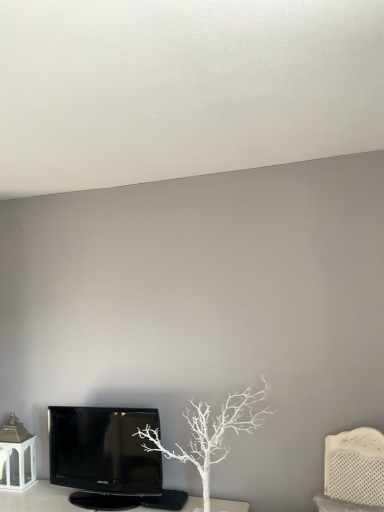
Question: Is white matte tree at center at the left side of white textured headboard at right?

Choices:
 (A) yes
 (B) no

Answer: (A)

Question: From the image's perspective, does white matte tree at center appear lower than white textured headboard at right?

Choices:
 (A) yes
 (B) no

Answer: (B)

Question: Does white matte tree at center have a lesser width compared to white textured headboard at right?

Choices:
 (A) yes
 (B) no

Answer: (B)

Question: Considering the relative sizes of white matte tree at center and white textured headboard at right in the image provided, is white matte tree at center wider than white textured headboard at right?

Choices:
 (A) yes
 (B) no

Answer: (A)

Question: Is white textured headboard at right completely or partially inside white matte tree at center?

Choices:
 (A) no
 (B) yes

Answer: (A)

Question: From the image's perspective, is white matte tree at center located above or below black glossy television at lower left?

Choices:
 (A) above
 (B) below

Answer: (A)

Question: From a real-world perspective, relative to black glossy television at lower left, is white matte tree at center vertically above or below?

Choices:
 (A) above
 (B) below

Answer: (A)

Question: Considering the positions of white matte tree at center and black glossy television at lower left in the image, is white matte tree at center bigger or smaller than black glossy television at lower left?

Choices:
 (A) small
 (B) big

Answer: (B)

Question: From their relative heights in the image, would you say white matte tree at center is taller or shorter than black glossy television at lower left?

Choices:
 (A) short
 (B) tall

Answer: (B)

Question: Is point (87, 454) positioned closer to the camera than point (193, 457)?

Choices:
 (A) farther
 (B) closer

Answer: (A)

Question: From a real-world perspective, is black glossy television at lower left above or below white matte tree at center?

Choices:
 (A) below
 (B) above

Answer: (A)

Question: Looking at their shapes, would you say black glossy television at lower left is wider or thinner than white matte tree at center?

Choices:
 (A) wide
 (B) thin

Answer: (B)

Question: From the image's perspective, is black glossy television at lower left located above or below white matte tree at center?

Choices:
 (A) below
 (B) above

Answer: (A)

Question: Is point (354, 449) positioned closer to the camera than point (140, 484)?

Choices:
 (A) farther
 (B) closer

Answer: (B)

Question: Is white textured headboard at right inside or outside of black glossy television at lower left?

Choices:
 (A) inside
 (B) outside

Answer: (B)